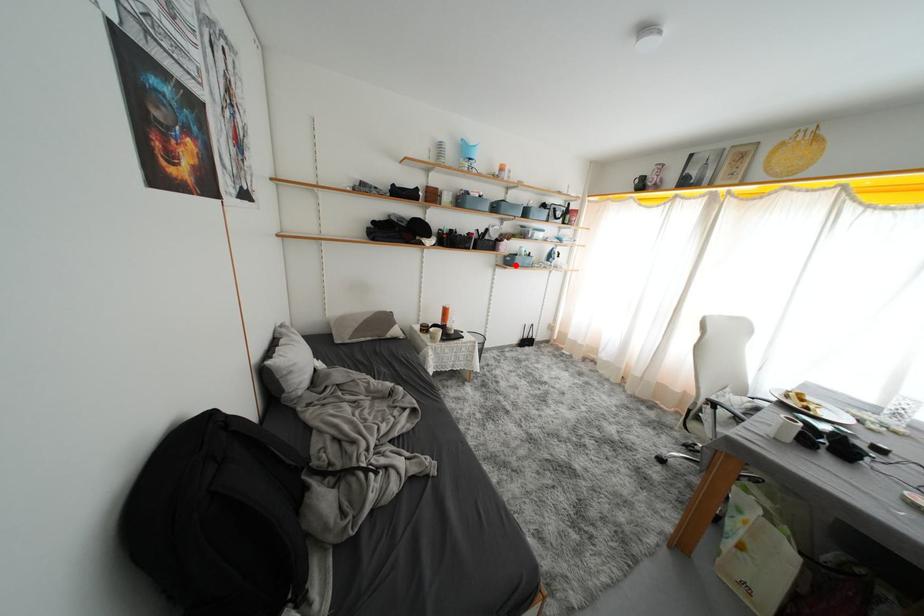
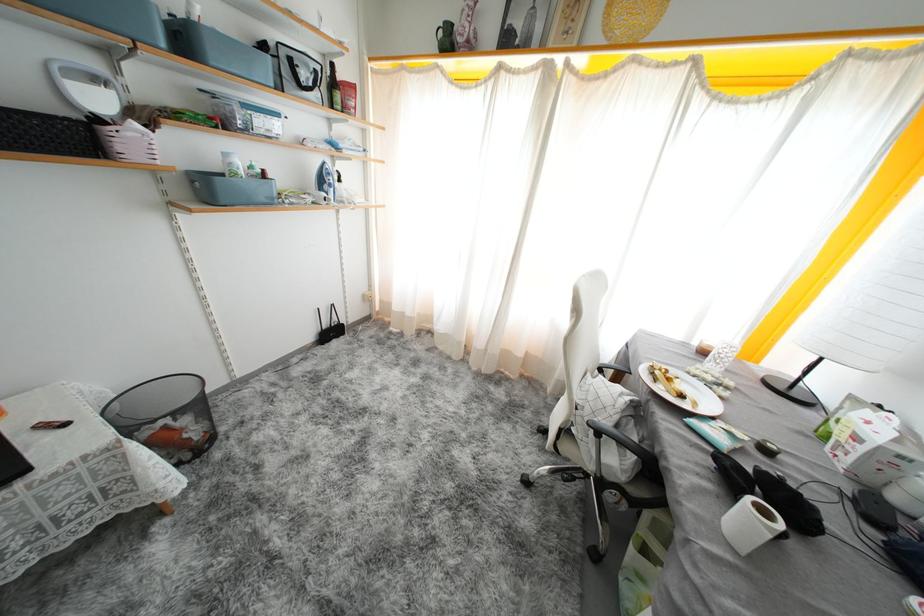
Question: I am providing you with two images of the same scene from different viewpoints. In image1, a red point is highlighted. Considering the same 3D point in image2, which of the following is correct?

Choices:
 (A) It is closer
 (B) It is farther

Answer: (B)